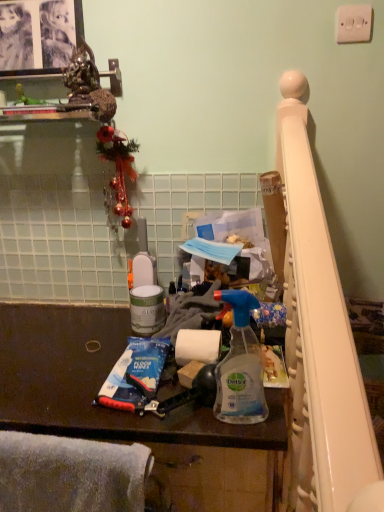
Where is `free space in front of white glossy paint can at center`? free space in front of white glossy paint can at center is located at coordinates (97, 360).